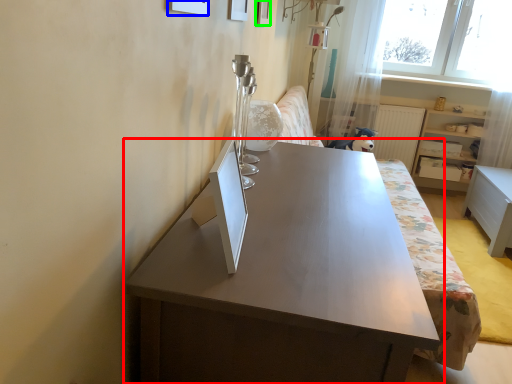
Question: Estimate the real-world distances between objects in this image. Which object is farther from table (highlighted by a red box), picture frame (highlighted by a blue box) or picture frame (highlighted by a green box)?

Choices:
 (A) picture frame
 (B) picture frame

Answer: (B)